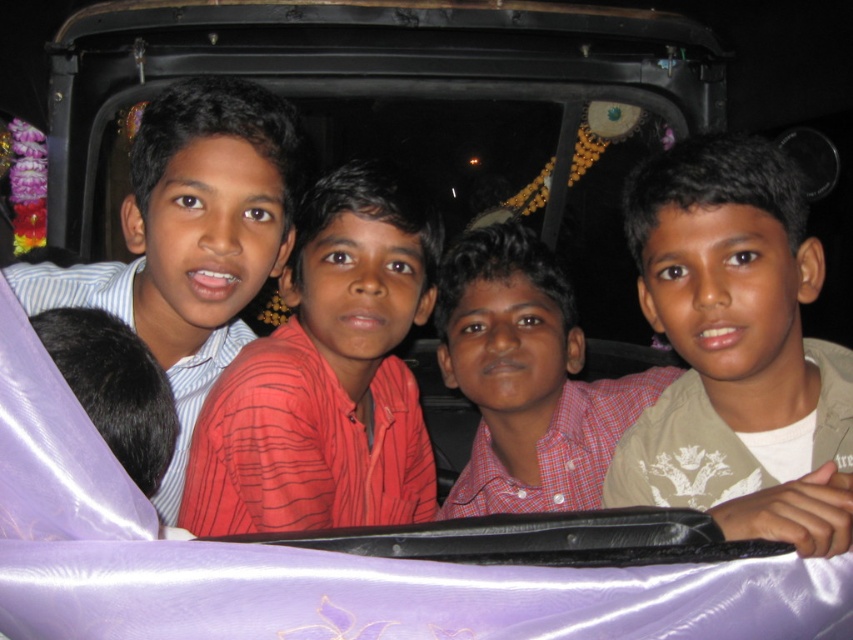
You are standing 3 meters away from the back of the vehicle where the boys are seated. You want to hand a snack to the red striped shirt at center. Can you reach them without moving closer?

The red striped shirt at center is 3.11 meters away from the viewer. Since you are standing 3 meters away from the back of the vehicle, the total distance would be more than 3 meters, so you cannot reach them without moving closer.

You are standing outside the vehicle and want to locate the red striped shirt at center. Based on the coordinates provided, where should you look relative to the other boys?

The red striped shirt at center is located at coordinates point (328,376), which is the center position relative to the other boys in the vehicle.

You are a photographer trying to capture a clear photo of the red striped shirt at center. However, the beige textured shirt at right is blocking part of it. Can you adjust your position to get a better shot without moving the shirts?

The beige textured shirt at right is positioned over the red striped shirt at center, so moving your camera position to the left might allow you to capture the red striped shirt at center without obstruction from the beige textured shirt at right.